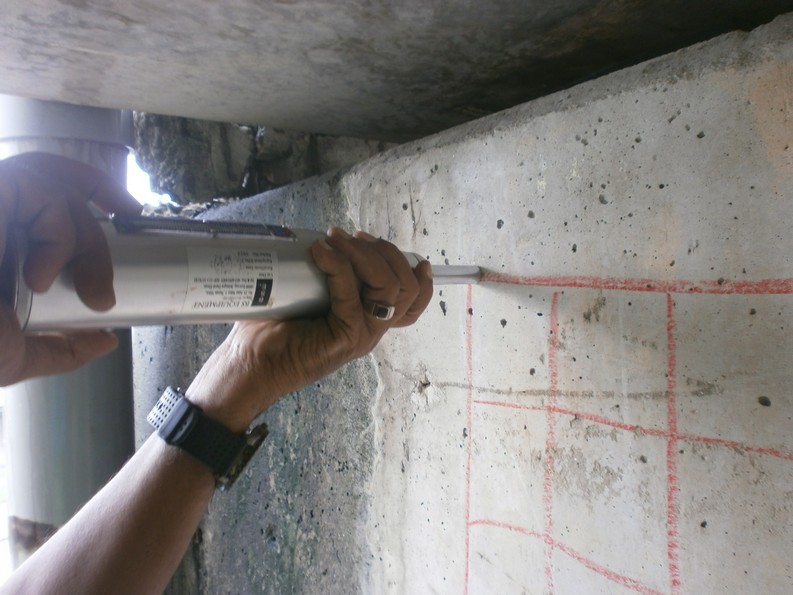
The image size is (793, 595). Identify the location of wall. (358, 529).